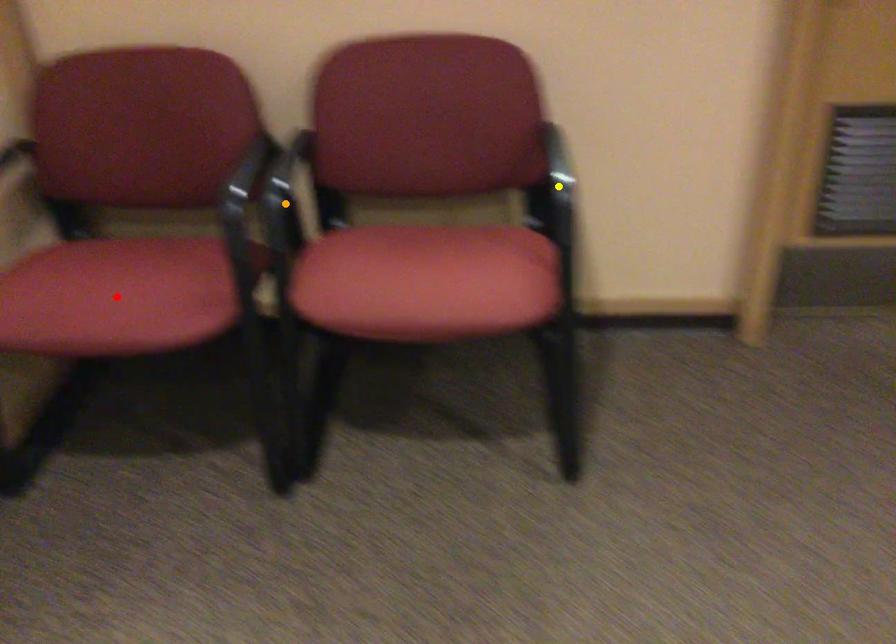
Order these from nearest to farthest:
1. orange point
2. yellow point
3. red point

yellow point, orange point, red point